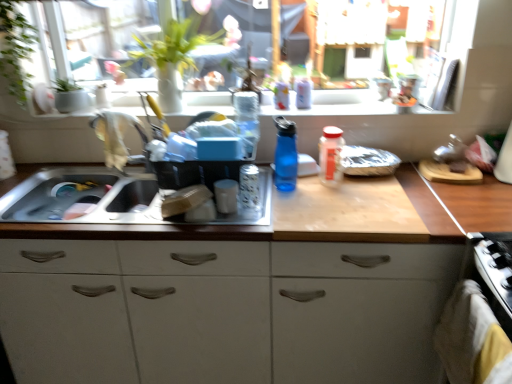
This screenshot has height=384, width=512. What do you see at coordinates (285, 155) in the screenshot? I see `blue plastic water bottle at center, placed as the 4th bottle when sorted from right to left` at bounding box center [285, 155].

Describe the element at coordinates (354, 26) in the screenshot. I see `transparent glass window at upper center` at that location.

What do you see at coordinates (333, 104) in the screenshot?
I see `matte white window sill at upper center` at bounding box center [333, 104].

Measure the distance between point (326, 168) and camera.

They are 5.26 feet apart.

The height and width of the screenshot is (384, 512). Find the location of `white matte cabinet at center`. white matte cabinet at center is located at coordinates (223, 311).

Considering the sizes of objects blue plastic water bottle at center, acting as the 2th bottle starting from the left, and white fabric oven at lower right in the image provided, who is smaller, blue plastic water bottle at center, acting as the 2th bottle starting from the left, or white fabric oven at lower right?

With smaller size is blue plastic water bottle at center, acting as the 2th bottle starting from the left.

Considering the positions of objects blue plastic water bottle at center, placed as the 4th bottle when sorted from right to left, and white fabric oven at lower right in the image provided, who is in front, blue plastic water bottle at center, placed as the 4th bottle when sorted from right to left, or white fabric oven at lower right?

white fabric oven at lower right is in front.

Is blue plastic water bottle at center, acting as the 2th bottle starting from the left, oriented away from white fabric oven at lower right?

No, blue plastic water bottle at center, acting as the 2th bottle starting from the left,'s orientation is not away from white fabric oven at lower right.

From the image's perspective, is blue plastic water bottle at center, acting as the 2th bottle starting from the left, under white fabric oven at lower right?

Actually, blue plastic water bottle at center, acting as the 2th bottle starting from the left, appears above white fabric oven at lower right in the image.

How different are the orientations of white plastic bottle at upper center, positioned as the 4th bottle in left-to-right order, and white matte cup at sink in degrees?

The facing directions of white plastic bottle at upper center, positioned as the 4th bottle in left-to-right order, and white matte cup at sink are 0.000163 degrees apart.

Considering the relative positions of white plastic bottle at upper center, positioned as the 4th bottle in left-to-right order, and white matte cup at sink in the image provided, is white plastic bottle at upper center, positioned as the 4th bottle in left-to-right order, in front of white matte cup at sink?

No, white plastic bottle at upper center, positioned as the 4th bottle in left-to-right order, is further to the viewer.

Is point (302, 89) closer or farther from the camera than point (225, 187)?

Point (302, 89) is positioned farther from the camera compared to point (225, 187).

From a real-world perspective, is white plastic bottle at upper center, placed as the 2th bottle when sorted from right to left, on white matte cup at sink?

Indeed, from a real-world perspective, white plastic bottle at upper center, placed as the 2th bottle when sorted from right to left, stands above white matte cup at sink.

Does white matte cup at sink touch translucent glass jar at sink, arranged as the fifth bottle when viewed from the right?

Yes, white matte cup at sink is next to translucent glass jar at sink, arranged as the fifth bottle when viewed from the right.

Is point (230, 201) positioned behind point (259, 188)?

No, (230, 201) is closer to viewer.

Can you confirm if white matte cup at sink is positioned to the right of translucent glass jar at sink, arranged as the fifth bottle when viewed from the right?

Incorrect, white matte cup at sink is not on the right side of translucent glass jar at sink, arranged as the fifth bottle when viewed from the right.

From the image's perspective, does white matte cup at sink appear higher than translucent glass jar at sink, the first bottle when ordered from left to right?

No.

From the picture: Is transparent glass window at upper center oriented away from white fabric at left?

No, transparent glass window at upper center's orientation is not away from white fabric at left.

This screenshot has height=384, width=512. I want to click on window on the right side of white fabric at left, so click(x=354, y=26).

Does transparent glass window at upper center have a greater height compared to white fabric at left?

Yes.

How far apart are transparent glass window at upper center and white fabric at left?

The distance of transparent glass window at upper center from white fabric at left is 20.24 inches.

Is blue plastic water bottle at center, placed as the 4th bottle when sorted from right to left, surrounding white plastic bottle at upper center, positioned as the 4th bottle in left-to-right order?

No, white plastic bottle at upper center, positioned as the 4th bottle in left-to-right order, is located outside of blue plastic water bottle at center, placed as the 4th bottle when sorted from right to left.

Based on the photo, can you tell me how much blue plastic water bottle at center, acting as the 2th bottle starting from the left, and white plastic bottle at upper center, placed as the 2th bottle when sorted from right to left, differ in facing direction?

1.87 degrees separate the facing orientations of blue plastic water bottle at center, acting as the 2th bottle starting from the left, and white plastic bottle at upper center, placed as the 2th bottle when sorted from right to left.

Is blue plastic water bottle at center, acting as the 2th bottle starting from the left, oriented towards white plastic bottle at upper center, positioned as the 4th bottle in left-to-right order?

No, blue plastic water bottle at center, acting as the 2th bottle starting from the left, does not turn towards white plastic bottle at upper center, positioned as the 4th bottle in left-to-right order.

Considering the sizes of objects blue plastic water bottle at center, placed as the 4th bottle when sorted from right to left, and white plastic bottle at upper center, positioned as the 4th bottle in left-to-right order, in the image provided, who is wider, blue plastic water bottle at center, placed as the 4th bottle when sorted from right to left, or white plastic bottle at upper center, positioned as the 4th bottle in left-to-right order,?

blue plastic water bottle at center, placed as the 4th bottle when sorted from right to left.

Is white matte cabinet at center at the left side of transparent glass window at upper center?

Indeed, white matte cabinet at center is positioned on the left side of transparent glass window at upper center.

Between point (133, 274) and point (322, 24), which one is positioned behind?

The point (322, 24) is more distant.

Measure the distance between white matte cabinet at center and transparent glass window at upper center.

The distance of white matte cabinet at center from transparent glass window at upper center is 33.04 inches.

What's the angular difference between white matte cabinet at center and transparent glass window at upper center's facing directions?

The facing directions of white matte cabinet at center and transparent glass window at upper center are 0.000142 degrees apart.

From the image's perspective, between translucent plastic bottle at center, the 1th bottle when ordered from right to left, and white plastic bottle at upper center, placed as the 2th bottle when sorted from right to left, who is located below?

translucent plastic bottle at center, the 1th bottle when ordered from right to left, is shown below in the image.

Which of these two, translucent plastic bottle at center, the 1th bottle when ordered from right to left, or white plastic bottle at upper center, positioned as the 4th bottle in left-to-right order, is wider?

With larger width is translucent plastic bottle at center, the 1th bottle when ordered from right to left.

Are translucent plastic bottle at center, the 1th bottle when ordered from right to left, and white plastic bottle at upper center, positioned as the 4th bottle in left-to-right order, beside each other?

No, translucent plastic bottle at center, the 1th bottle when ordered from right to left, is not in contact with white plastic bottle at upper center, positioned as the 4th bottle in left-to-right order.

Which bottle is the 1st one when counting from the front of the white plastic bottle at upper center, positioned as the 4th bottle in left-to-right order? Please provide its 2D coordinates.

[(331, 156)]

Starting from the white fabric oven at lower right, which bottle is the 2nd one behind? Please provide its 2D coordinates.

[(285, 155)]

Where is `appliance that appears below the white plastic bottle at upper center, positioned as the 4th bottle in left-to-right order (from the image's perspective)`? The image size is (512, 384). appliance that appears below the white plastic bottle at upper center, positioned as the 4th bottle in left-to-right order (from the image's perspective) is located at coordinates (226, 195).

When comparing their distances from transparent glass window at upper center, does white fabric at left or white fabric oven at lower right seem closer?

white fabric at left lies closer to transparent glass window at upper center than the other object.

Which object lies nearer to the anchor point green leafy plant at upper left, white fabric at left or translucent glass jar at sink, arranged as the fifth bottle when viewed from the right?

Based on the image, white fabric at left appears to be nearer to green leafy plant at upper left.

Looking at the image, which one is located further to translucent plastic bottle at center, the fifth bottle positioned from the left, white fabric at left or white fabric oven at lower right?

white fabric at left is positioned further to the anchor translucent plastic bottle at center, the fifth bottle positioned from the left.

When comparing their distances from blue plastic water bottle at center, acting as the 2th bottle starting from the left, does white matte cup at sink or white fabric at left seem further?

Among the two, white fabric at left is located further to blue plastic water bottle at center, acting as the 2th bottle starting from the left.

From the image, which object appears to be farther from translucent glass jar at sink, the first bottle when ordered from left to right, blue plastic water bottle at center, placed as the 4th bottle when sorted from right to left, or white plastic bottle at upper center, placed as the 2th bottle when sorted from right to left?

The object further to translucent glass jar at sink, the first bottle when ordered from left to right, is white plastic bottle at upper center, placed as the 2th bottle when sorted from right to left.

Looking at the image, which one is located closer to translucent plastic bottle at center, marked as the third bottle in a right-to-left arrangement, green leafy plant at upper left or white fabric oven at lower right?

Based on the image, green leafy plant at upper left appears to be nearer to translucent plastic bottle at center, marked as the third bottle in a right-to-left arrangement.

Estimate the real-world distances between objects in this image. Which object is further from white matte cabinet at center, translucent plastic bottle at center, marked as the 3th bottle in a left-to-right arrangement, or translucent plastic bottle at center, the 1th bottle when ordered from right to left?

translucent plastic bottle at center, marked as the 3th bottle in a left-to-right arrangement.

Based on their spatial positions, is white fabric oven at lower right or blue plastic water bottle at center, acting as the 2th bottle starting from the left, further from white matte cup at sink?

white fabric oven at lower right is positioned further to the anchor white matte cup at sink.

The width and height of the screenshot is (512, 384). I want to click on faucet between green leafy plant at upper left and translucent plastic bottle at center, marked as the 3th bottle in a left-to-right arrangement, so click(115, 135).

Identify the location of window sill located between green leafy plant at upper left and white fabric oven at lower right in the left-right direction. The height and width of the screenshot is (384, 512). (333, 104).

This screenshot has height=384, width=512. In order to click on window sill between transparent glass window at upper center and translucent glass jar at sink, the first bottle when ordered from left to right, from top to bottom in this screenshot , I will do `click(333, 104)`.

You are a GUI agent. You are given a task and a screenshot of the screen. Output one action in this format:
    pyautogui.click(x=<x>, y=<y>)
    Task: Click on the window sill between transparent glass window at upper center and white matte cup at sink vertically
    The height and width of the screenshot is (384, 512).
    Given the screenshot: What is the action you would take?
    pyautogui.click(x=333, y=104)